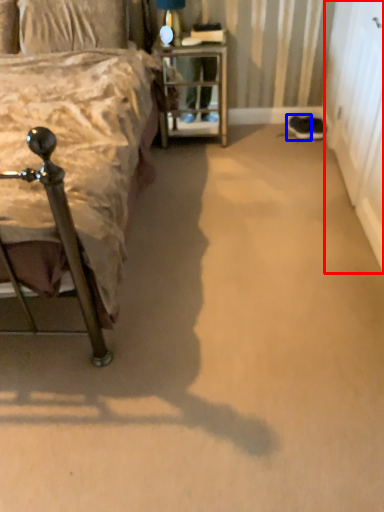
Question: Which object is closer to the camera taking this photo, screen door (highlighted by a red box) or footwear (highlighted by a blue box)?

Choices:
 (A) screen door
 (B) footwear

Answer: (A)